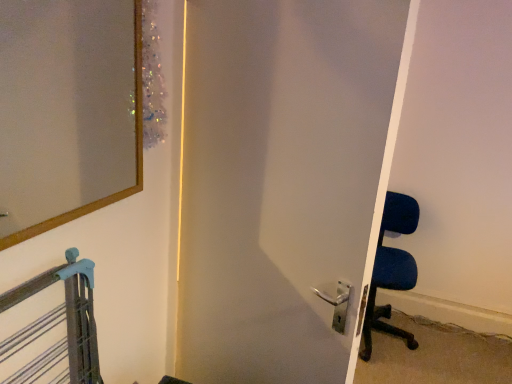
Question: Is satin white door at center outside wooden-framed mirror at upper left?

Choices:
 (A) yes
 (B) no

Answer: (A)

Question: Is wooden-framed mirror at upper left surrounded by satin white door at center?

Choices:
 (A) yes
 (B) no

Answer: (B)

Question: Is satin white door at center far away from wooden-framed mirror at upper left?

Choices:
 (A) yes
 (B) no

Answer: (B)

Question: Considering the relative sizes of satin white door at center and wooden-framed mirror at upper left in the image provided, is satin white door at center bigger than wooden-framed mirror at upper left?

Choices:
 (A) no
 (B) yes

Answer: (B)

Question: Considering the relative sizes of satin white door at center and wooden-framed mirror at upper left in the image provided, is satin white door at center thinner than wooden-framed mirror at upper left?

Choices:
 (A) yes
 (B) no

Answer: (B)

Question: Looking at their shapes, would you say satin white door at center is wider or thinner than blue fabric chair at right?

Choices:
 (A) thin
 (B) wide

Answer: (A)

Question: Visually, is satin white door at center positioned to the left or to the right of blue fabric chair at right?

Choices:
 (A) left
 (B) right

Answer: (A)

Question: Is satin white door at center taller or shorter than blue fabric chair at right?

Choices:
 (A) tall
 (B) short

Answer: (A)

Question: Is satin white door at center inside or outside of blue fabric chair at right?

Choices:
 (A) outside
 (B) inside

Answer: (A)

Question: From a real-world perspective, relative to satin white door at center, is wooden-framed mirror at upper left vertically above or below?

Choices:
 (A) below
 (B) above

Answer: (B)

Question: Is wooden-framed mirror at upper left bigger or smaller than satin white door at center?

Choices:
 (A) big
 (B) small

Answer: (B)

Question: From the image's perspective, is wooden-framed mirror at upper left positioned above or below satin white door at center?

Choices:
 (A) below
 (B) above

Answer: (B)

Question: Visually, is wooden-framed mirror at upper left positioned to the left or to the right of satin white door at center?

Choices:
 (A) right
 (B) left

Answer: (B)

Question: From their relative heights in the image, would you say satin white door at center is taller or shorter than wooden-framed mirror at upper left?

Choices:
 (A) tall
 (B) short

Answer: (A)

Question: From the image's perspective, relative to wooden-framed mirror at upper left, is satin white door at center above or below?

Choices:
 (A) below
 (B) above

Answer: (A)